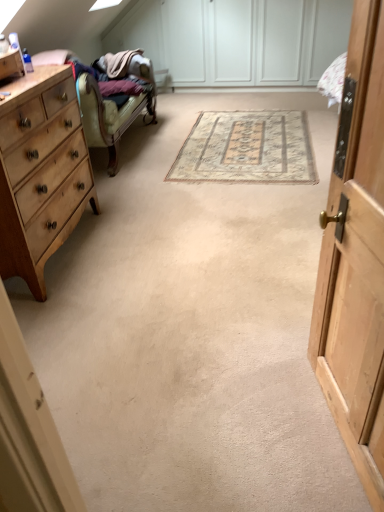
Question: From a real-world perspective, is wooden cabinet at right above or below beige woven rug at center?

Choices:
 (A) below
 (B) above

Answer: (B)

Question: Which is correct: wooden cabinet at right is inside beige woven rug at center, or outside of it?

Choices:
 (A) inside
 (B) outside

Answer: (B)

Question: Which is farther from the light wood/finish chest of drawers at left?

Choices:
 (A) wooden cabinet at right
 (B) beige woven rug at center

Answer: (A)

Question: Which of these objects is positioned farthest from the light wood/finish chest of drawers at left?

Choices:
 (A) beige woven rug at center
 (B) wooden cabinet at right

Answer: (B)